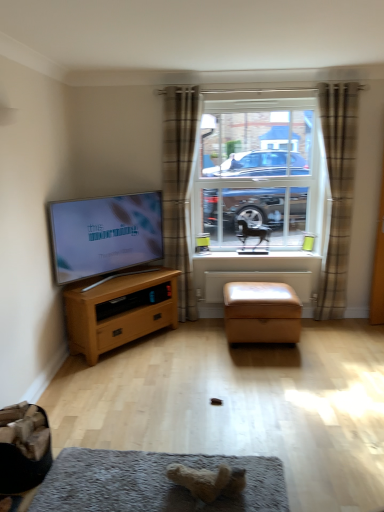
Question: Can you confirm if plaid fabric curtain at center, the first curtain viewed from the left, is taller than wooden chest of drawers at left?

Choices:
 (A) no
 (B) yes

Answer: (B)

Question: From a real-world perspective, is plaid fabric curtain at center, the first curtain viewed from the left, physically below wooden chest of drawers at left?

Choices:
 (A) yes
 (B) no

Answer: (B)

Question: Is plaid fabric curtain at center, the first curtain viewed from the left, thinner than wooden chest of drawers at left?

Choices:
 (A) yes
 (B) no

Answer: (A)

Question: Does plaid fabric curtain at center, the first curtain viewed from the left, turn towards wooden chest of drawers at left?

Choices:
 (A) no
 (B) yes

Answer: (A)

Question: From the image's perspective, is plaid fabric curtain at center, the first curtain viewed from the left, below wooden chest of drawers at left?

Choices:
 (A) no
 (B) yes

Answer: (A)

Question: Which is correct: fuzzy beige teddy bear at lower center, positioned as the 2th animal in top-to-bottom order, is inside white painted wood at center, or outside of it?

Choices:
 (A) outside
 (B) inside

Answer: (A)

Question: Looking at the image, does fuzzy beige teddy bear at lower center, the first animal ordered from the bottom, seem bigger or smaller compared to white painted wood at center?

Choices:
 (A) big
 (B) small

Answer: (B)

Question: From their relative heights in the image, would you say fuzzy beige teddy bear at lower center, the 1th animal when ordered from left to right, is taller or shorter than white painted wood at center?

Choices:
 (A) tall
 (B) short

Answer: (A)

Question: In the image, is fuzzy beige teddy bear at lower center, positioned as the first animal in front-to-back order, on the left side or the right side of white painted wood at center?

Choices:
 (A) left
 (B) right

Answer: (A)

Question: From a real-world perspective, is matte black tv at left physically located above or below clear glass window at center?

Choices:
 (A) above
 (B) below

Answer: (B)

Question: Does point (137, 208) appear closer or farther from the camera than point (314, 209)?

Choices:
 (A) farther
 (B) closer

Answer: (B)

Question: Would you say matte black tv at left is to the left or to the right of clear glass window at center in the picture?

Choices:
 (A) right
 (B) left

Answer: (B)

Question: Considering the positions of matte black tv at left and clear glass window at center in the image, is matte black tv at left taller or shorter than clear glass window at center?

Choices:
 (A) short
 (B) tall

Answer: (A)

Question: From the image's perspective, is wooden chest of drawers at left above or below soft gray carpet at lower center?

Choices:
 (A) above
 (B) below

Answer: (A)

Question: Considering the positions of wooden chest of drawers at left and soft gray carpet at lower center in the image, is wooden chest of drawers at left wider or thinner than soft gray carpet at lower center?

Choices:
 (A) thin
 (B) wide

Answer: (A)